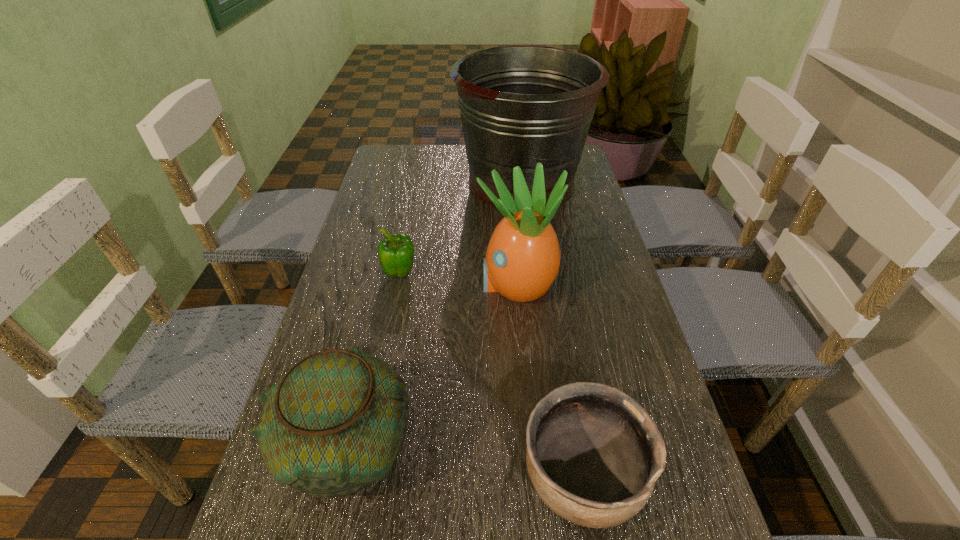
What are the coordinates of `vacant space located on the front of the bell pepper` in the screenshot? It's located at (388, 337).

What are the coordinates of `object at the far edge` in the screenshot? It's located at coord(520,105).

I want to click on pottery situated at the left edge, so click(x=335, y=423).

Find the location of a particular element. Image resolution: width=960 pixels, height=540 pixels. bell pepper present at the left edge is located at coordinates (396, 252).

Find the location of a particular element. object present at the right edge is located at coordinates click(x=520, y=105).

Locate an element on the screen. This screenshot has height=540, width=960. object positioned at the far right corner is located at coordinates (520, 105).

The image size is (960, 540). In the image, there is a desktop. Identify the location of free region at the far edge. (445, 172).

Find the location of a particular element. vacant space at the left edge of the desktop is located at coordinates (372, 179).

This screenshot has height=540, width=960. In the image, there is a desktop. Find the location of `vacant region at the right edge`. vacant region at the right edge is located at coordinates (665, 411).

In order to click on free location at the far right corner in this screenshot , I will do [x=582, y=158].